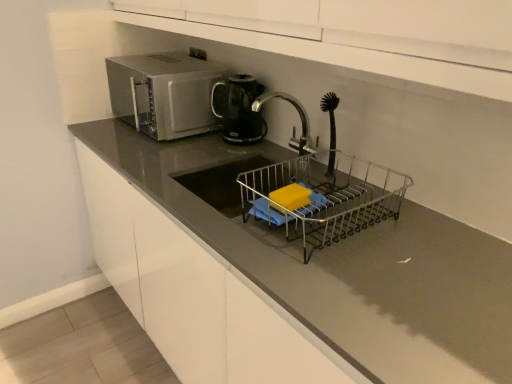
The width and height of the screenshot is (512, 384). What are the coordinates of `free space in front of metallic wire dish rack at center` in the screenshot? It's located at (372, 293).